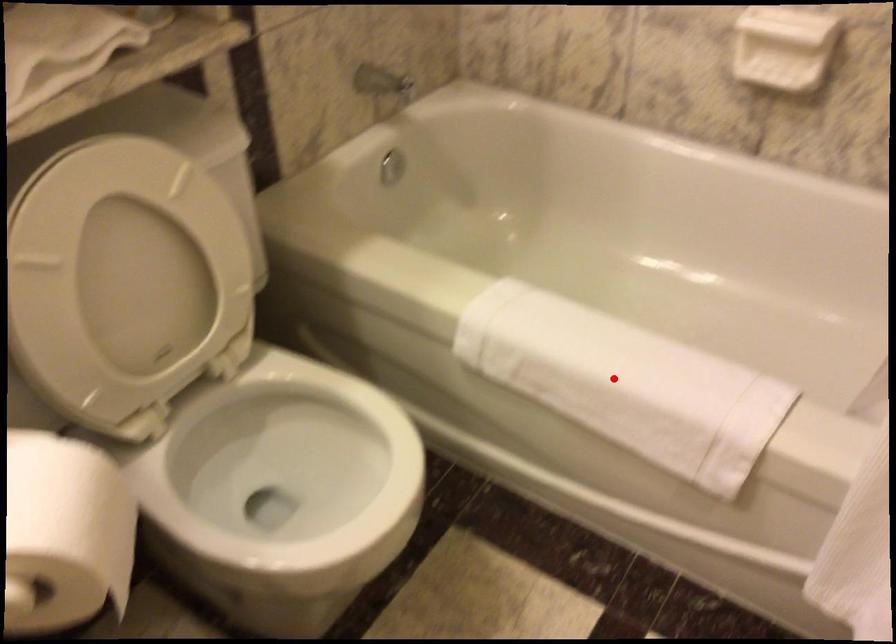
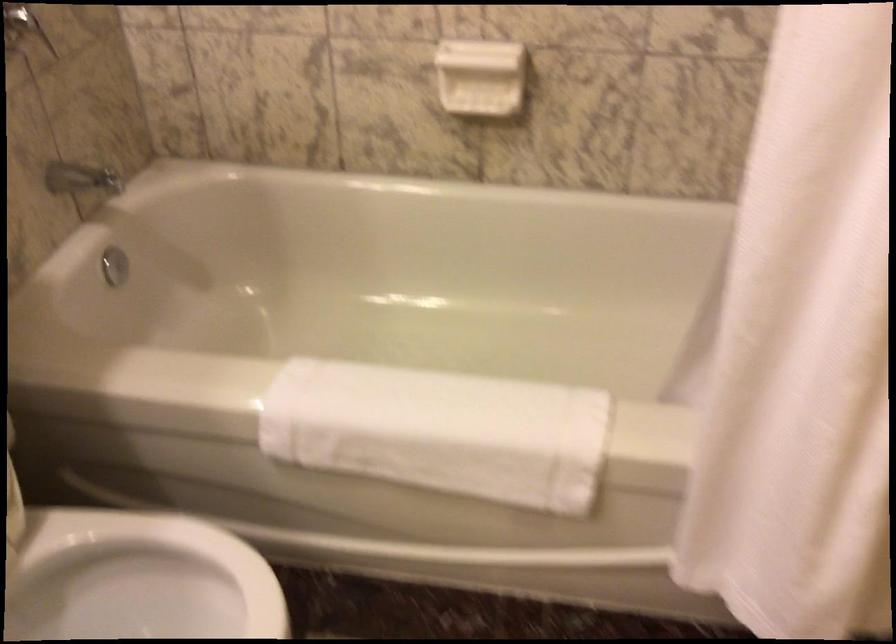
In the second image, find the point that corresponds to the highlighted location in the first image.

(440, 431)